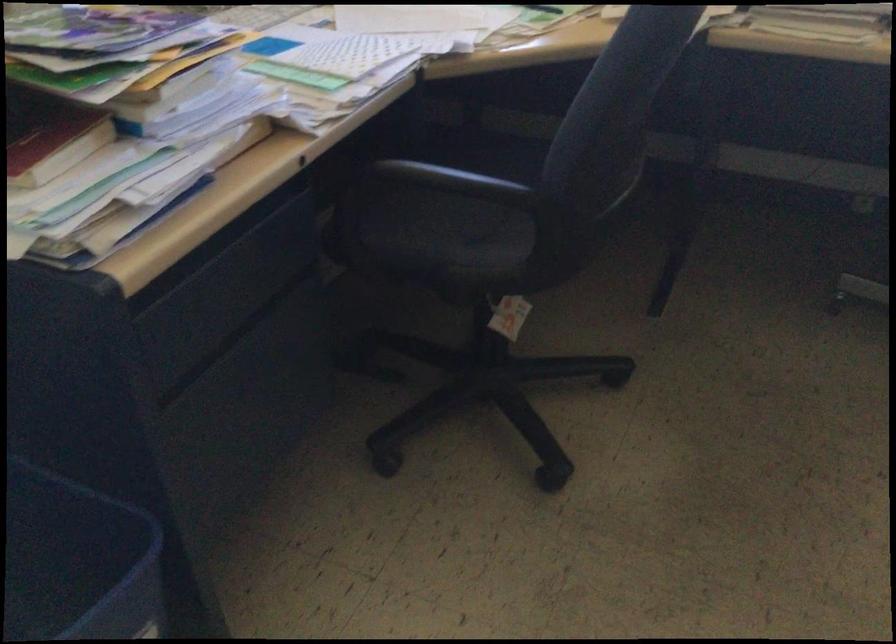
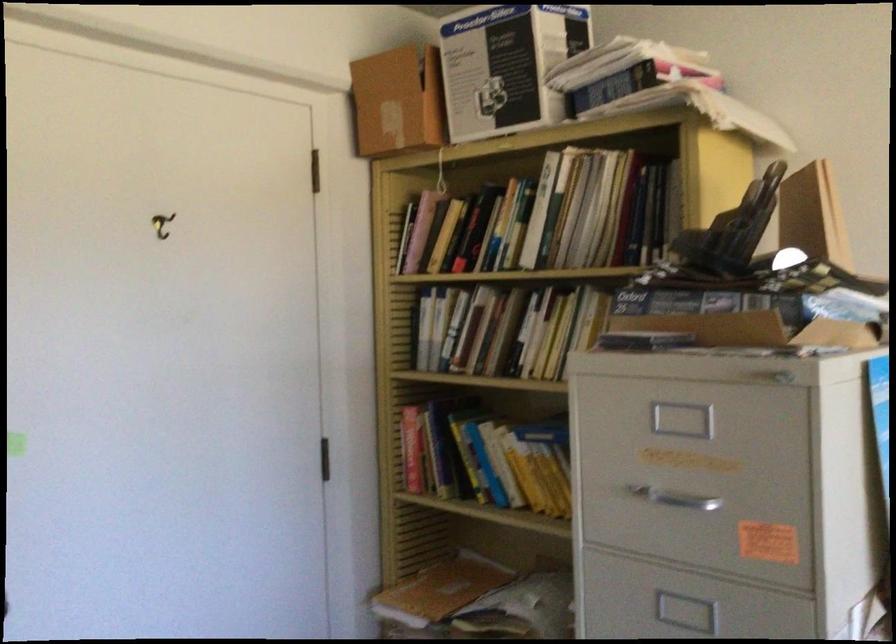
Question: The images are taken continuously from a first-person perspective. In which direction is your viewpoint rotating?

Choices:
 (A) Left
 (B) Right
 (C) Up
 (D) Down

Answer: (A)